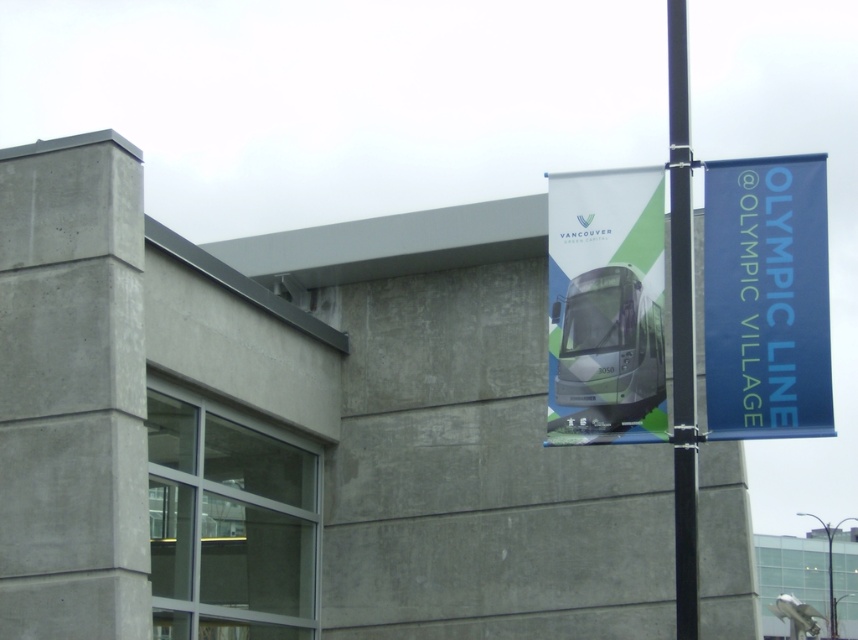
You are a city planner assessing the width of the banners and buses for a new advertising campaign. Given the scene described, can you determine if the blue fabric banner at upper right is wider than the green matte bus at center?

The blue fabric banner at upper right might be wider than the green matte bus at center according to the description, so it is possible that the banner is wider, but the exact measurement isn not provided.

You are standing in front of the building and want to hang a new banner that is 2 meters long. The blue fabric banner at upper right and the black metal pole at right are already present. Which object can the new banner fit under without exceeding its length?

The blue fabric banner at upper right is shorter than the black metal pole at right. Since the new banner is 2 meters long, it can fit under the blue fabric banner at upper right if the banner is shorter than 2 meters. However, without knowing the exact length of the blue fabric banner at upper right, it is uncertain. Alternatively, if the black metal pole at right is taller than 2 meters, the banner could fit under it. But since the banner is shorter than the pole, the pole is taller. Therefore, the new 2m